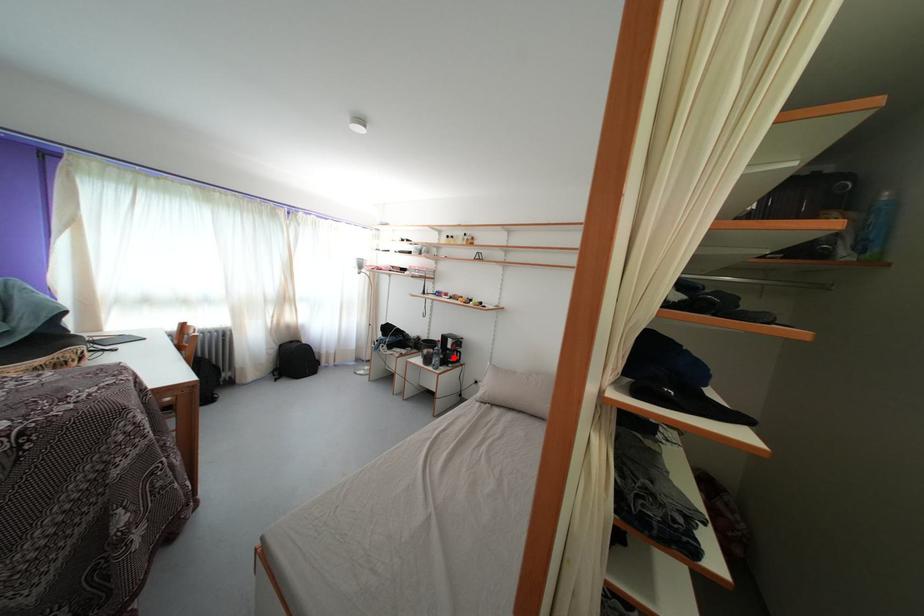
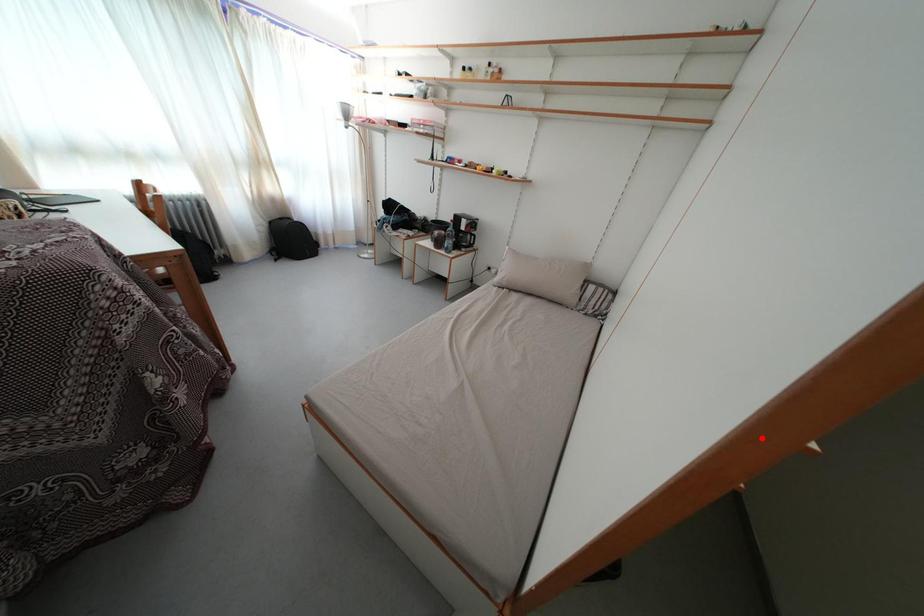
I am providing you with two images of the same scene from different viewpoints. A red point is marked on the first image and another point is marked on the second image. Is the marked point in image1 the same physical position as the marked point in image2?

No